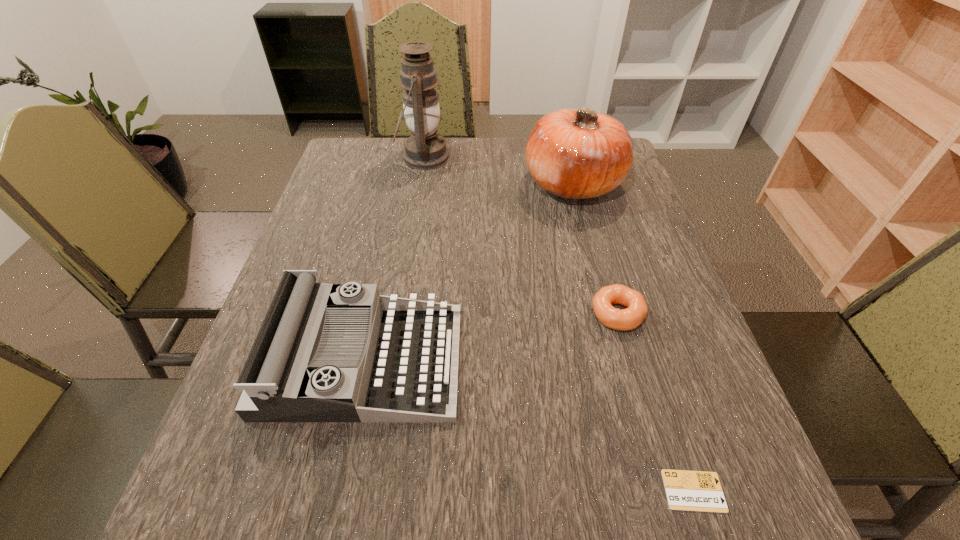
You are a GUI agent. You are given a task and a screenshot of the screen. Output one action in this format:
    pyautogui.click(x=<x>, y=<y>)
    Task: Click on the free region located on the left of the identity card
    This screenshot has height=540, width=960.
    Given the screenshot: What is the action you would take?
    pyautogui.click(x=633, y=491)

What are the coordinates of `oil lamp situated at the far edge` in the screenshot? It's located at (425, 149).

Find the location of a particular element. This screenshot has width=960, height=540. pumpkin that is at the far edge is located at coordinates 579,153.

Locate an element on the screen. Image resolution: width=960 pixels, height=540 pixels. object located at the near edge is located at coordinates (701, 491).

Find the location of a particular element. object at the left edge is located at coordinates (325, 352).

Image resolution: width=960 pixels, height=540 pixels. What are the coordinates of `pumpkin situated at the right edge` in the screenshot? It's located at (579, 153).

Identify the location of doughnut located in the right edge section of the desktop. Image resolution: width=960 pixels, height=540 pixels. (626, 319).

Identify the location of identity card at the right edge. (701, 491).

Find the location of `object positioned at the far right corner`. object positioned at the far right corner is located at coordinates pos(579,153).

Identify the location of object located in the near right corner section of the desktop. The width and height of the screenshot is (960, 540). (701, 491).